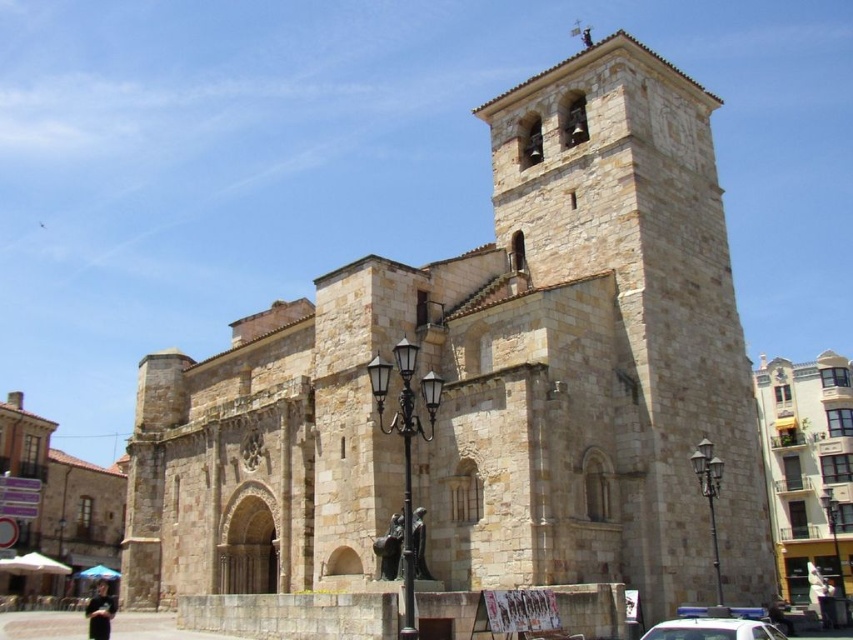
Question: Can you confirm if beige stone church at center is thinner than white plastic car at center?

Choices:
 (A) no
 (B) yes

Answer: (A)

Question: Among these points, which one is farthest from the camera?

Choices:
 (A) click(x=677, y=628)
 (B) click(x=782, y=538)

Answer: (B)

Question: Which object appears farthest from the camera in this image?

Choices:
 (A) white plastic car at center
 (B) beige stone church at center

Answer: (B)

Question: Can you confirm if beige stone church at center is positioned above white plastic car at center?

Choices:
 (A) no
 (B) yes

Answer: (B)

Question: Does beige stone church at center appear under white plastic car at center?

Choices:
 (A) no
 (B) yes

Answer: (A)